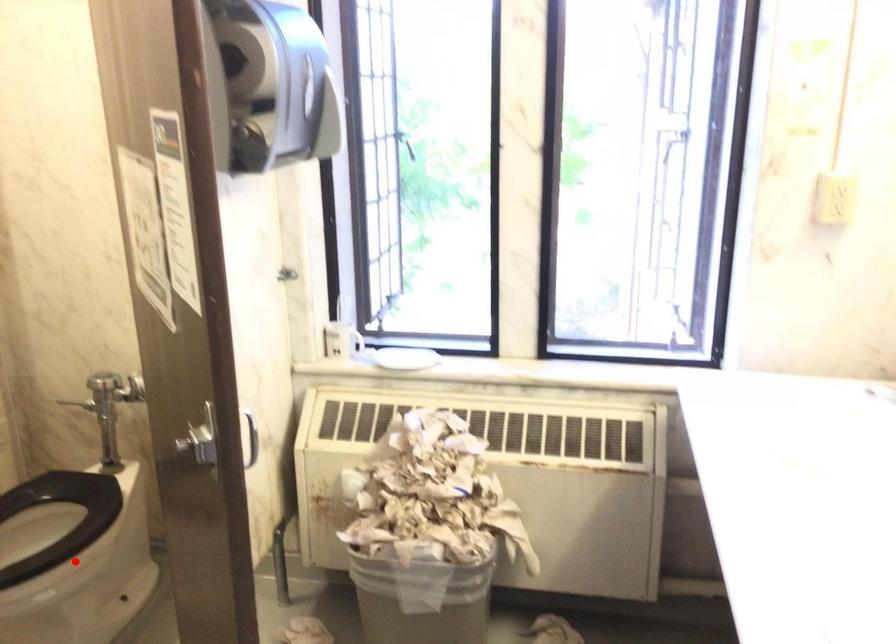
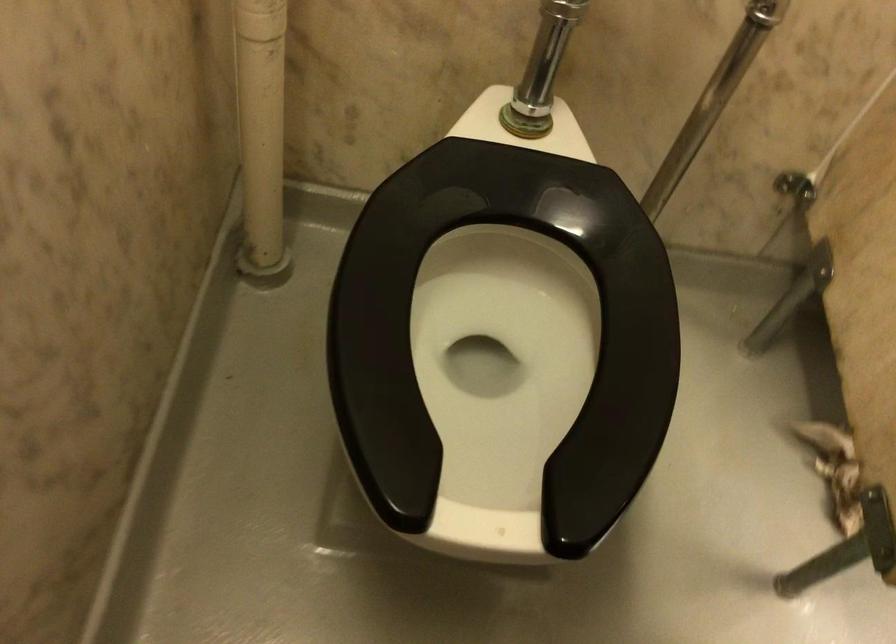
Question: I am providing you with two images of the same scene from different viewpoints. Given a red point in image1, look at the same physical point in image2. Is it:

Choices:
 (A) Closer to the viewpoint
 (B) Farther from the viewpoint

Answer: (A)